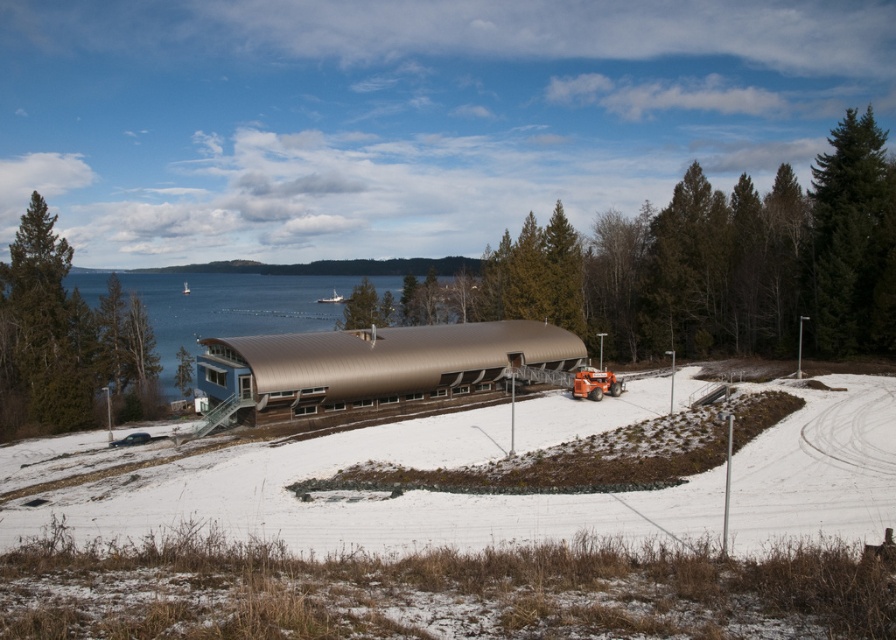
Looking at this image, you are standing in front of the modern building and want to take a photo of both the green textured tree at left and the green textured pine tree at right in the same frame. Which direction should you face to ensure both trees are visible?

You should face towards the center between the green textured tree at left and the green textured pine tree at right since the green textured tree at left is positioned to the left of the green textured pine tree at right.

You are a maintenance worker needing to reach the metallic water at center from the green textured tree at left. The path is clear but you have a 65 meter rope. Do you think the rope is sufficient to reach the water?

The distance between the green textured tree at left and the metallic water at center is 67.07 meters. Since the rope is only 65 meters long, it is not long enough to span the distance between the green textured tree at left and the metallic water at center.

You are a visitor standing at the entrance of the modern building. You see the green textured tree at left and the metallic water at center. Which object is closer to your eye level?

The metallic water at center is taller than the green textured tree at left, so the metallic water at center is closer to your eye level.